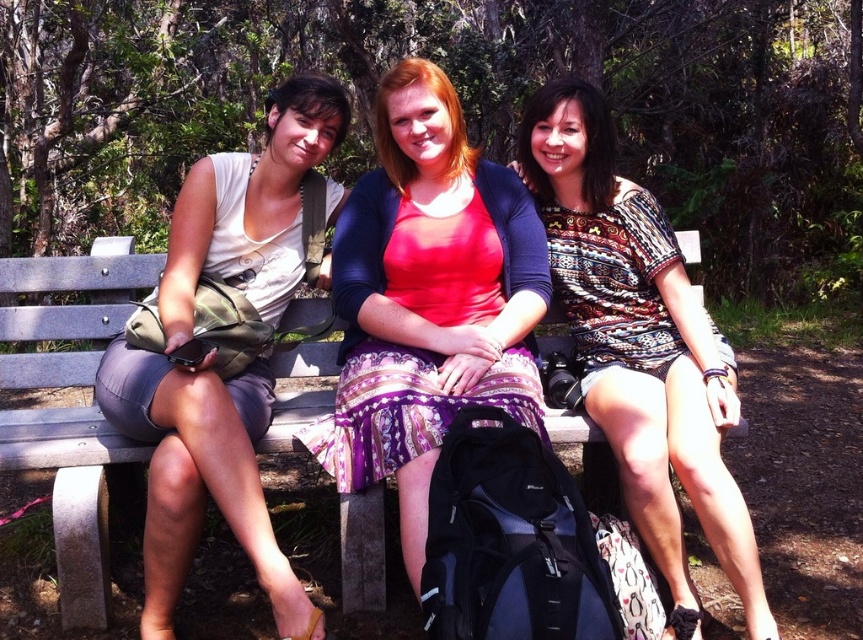
Does matte pink dress at center have a lesser height compared to wooden bench at center?

No, matte pink dress at center is not shorter than wooden bench at center.

At what (x,y) coordinates should I click in order to perform the action: click on matte pink dress at center. Please return your answer as a coordinate pair (x, y). Looking at the image, I should click on (427, 298).

Is printed cotton dress at center thinner than wooden bench at center?

Correct, printed cotton dress at center's width is less than wooden bench at center's.

Between printed cotton dress at center and wooden bench at center, which one is positioned lower?

Positioned lower is wooden bench at center.

Is point (587, 323) closer to camera compared to point (55, 532)?

No.

What are the coordinates of `printed cotton dress at center` in the screenshot? It's located at (640, 346).

Does matte white tank top at left have a smaller size compared to wooden bench at center?

No, matte white tank top at left is not smaller than wooden bench at center.

Does point (219, 492) come behind point (36, 269)?

No, it is not.

Image resolution: width=863 pixels, height=640 pixels. Describe the element at coordinates (200, 476) in the screenshot. I see `matte white tank top at left` at that location.

Find the location of `matte white tank top at left`. matte white tank top at left is located at coordinates (200, 476).